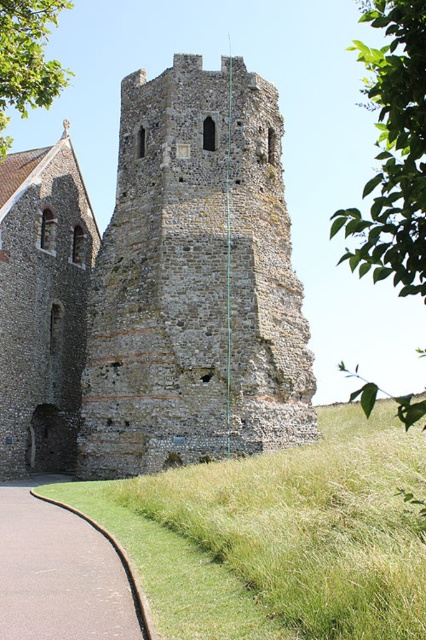
Question: Can you confirm if gray stone tower at center is smaller than asphalt road at lower left?

Choices:
 (A) yes
 (B) no

Answer: (B)

Question: Is gray stone tower at center positioned behind asphalt road at lower left?

Choices:
 (A) yes
 (B) no

Answer: (A)

Question: Can you confirm if gray stone tower at center is positioned to the right of asphalt road at lower left?

Choices:
 (A) yes
 (B) no

Answer: (B)

Question: Which object appears closest to the camera in this image?

Choices:
 (A) asphalt road at lower left
 (B) gray stone tower at center

Answer: (A)